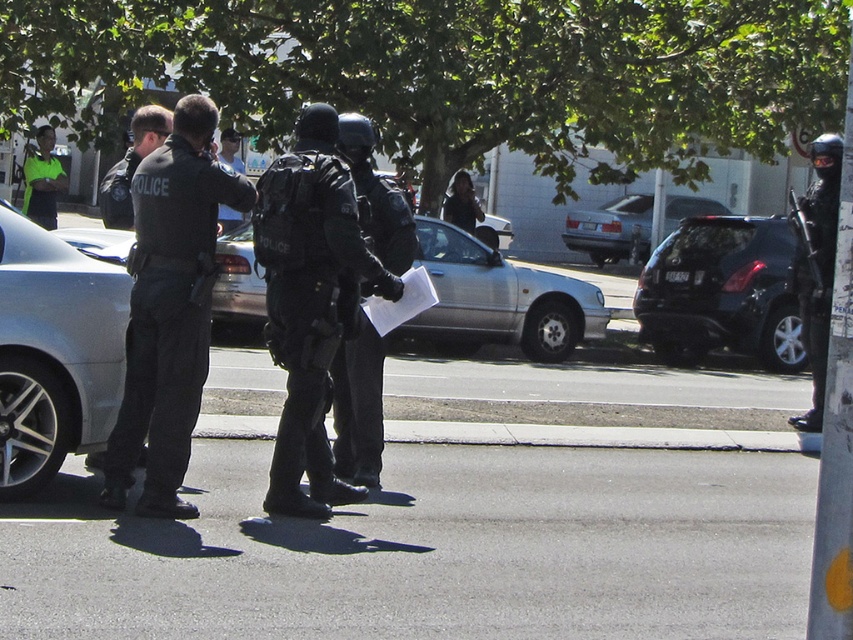
Question: Estimate the real-world distances between objects in this image. Which object is closer to the black matte uniform at center?

Choices:
 (A) black tactical gear at center
 (B) dark gray uniform at center

Answer: (A)

Question: Is dark gray uniform at center above silver metallic sedan at center?

Choices:
 (A) no
 (B) yes

Answer: (A)

Question: Which is farther from the metallic silver car at left?

Choices:
 (A) silver metallic car at center
 (B) dark gray uniform at center
 (C) black matte car at right

Answer: (C)

Question: Among these points, which one is nearest to the camera?

Choices:
 (A) (370, 177)
 (B) (3, 273)

Answer: (B)

Question: Does black tactical gear at center appear over silver metallic car at center?

Choices:
 (A) yes
 (B) no

Answer: (B)

Question: Is black tactical gear at center to the left of black matte car at right from the viewer's perspective?

Choices:
 (A) no
 (B) yes

Answer: (B)